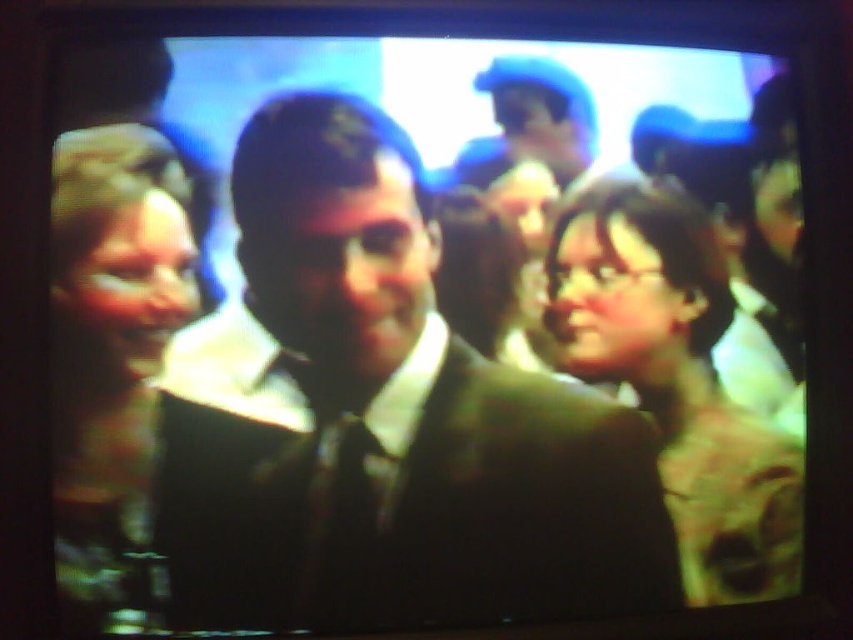
Question: Does matte black dress at left have a larger size compared to matte black glasses at center?

Choices:
 (A) yes
 (B) no

Answer: (B)

Question: Considering the relative positions of matte black suit at center and matte black dress at left in the image provided, where is matte black suit at center located with respect to matte black dress at left?

Choices:
 (A) right
 (B) left

Answer: (A)

Question: Is matte black suit at center positioned behind matte black dress at left?

Choices:
 (A) no
 (B) yes

Answer: (B)

Question: Which point is closer to the camera?

Choices:
 (A) matte black glasses at center
 (B) matte black suit at center

Answer: (B)

Question: Which object appears closest to the camera in this image?

Choices:
 (A) matte black glasses at center
 (B) matte black dress at left

Answer: (B)

Question: Which object is the closest to the matte black suit at center?

Choices:
 (A) matte black glasses at center
 (B) matte black dress at left

Answer: (B)